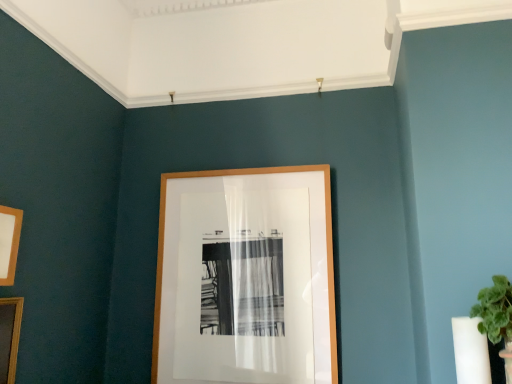
Question: From a real-world perspective, does wooden picture frame at lower left, which is counted as the 3th picture frame, starting from the back, sit lower than wooden picture frame at center, positioned as the third picture frame in left-to-right order?

Choices:
 (A) no
 (B) yes

Answer: (B)

Question: Is wooden picture frame at lower left, which appears as the 3th picture frame when viewed from the right, looking in the opposite direction of wooden picture frame at center, marked as the 3th picture frame in a front-to-back arrangement?

Choices:
 (A) yes
 (B) no

Answer: (B)

Question: Can you confirm if wooden picture frame at lower left, which appears as the 3th picture frame when viewed from the right, is thinner than wooden picture frame at center, marked as the 3th picture frame in a front-to-back arrangement?

Choices:
 (A) yes
 (B) no

Answer: (A)

Question: Is wooden picture frame at lower left, which appears as the 3th picture frame when viewed from the right, directly adjacent to wooden picture frame at center, positioned as the third picture frame in left-to-right order?

Choices:
 (A) no
 (B) yes

Answer: (A)

Question: From the image's perspective, does wooden picture frame at lower left, the first picture frame positioned from the left, appear lower than wooden picture frame at center, positioned as the third picture frame in left-to-right order?

Choices:
 (A) no
 (B) yes

Answer: (B)

Question: Visually, is wooden picture frame at center, the 1th picture frame viewed from the right, positioned to the left or to the right of wooden picture frame at left, which is the second picture frame in right-to-left order?

Choices:
 (A) left
 (B) right

Answer: (B)

Question: From the image's perspective, is wooden picture frame at center, the 1th picture frame viewed from the right, positioned above or below wooden picture frame at left, the 2th picture frame in the left-to-right sequence?

Choices:
 (A) above
 (B) below

Answer: (B)

Question: Is wooden picture frame at center, which ranks as the 1th picture frame in back-to-front order, inside or outside of wooden picture frame at left, which is the second picture frame in right-to-left order?

Choices:
 (A) inside
 (B) outside

Answer: (B)

Question: From a real-world perspective, is wooden picture frame at center, positioned as the third picture frame in left-to-right order, above or below wooden picture frame at left, acting as the second picture frame starting from the front?

Choices:
 (A) below
 (B) above

Answer: (A)

Question: Is wooden picture frame at center, marked as the 3th picture frame in a front-to-back arrangement, inside or outside of wooden picture frame at lower left, which appears as the 3th picture frame when viewed from the right?

Choices:
 (A) outside
 (B) inside

Answer: (A)

Question: From the image's perspective, relative to wooden picture frame at lower left, the first picture frame positioned from the left, is wooden picture frame at center, marked as the 3th picture frame in a front-to-back arrangement, above or below?

Choices:
 (A) below
 (B) above

Answer: (B)

Question: Is point (263, 372) closer or farther from the camera than point (7, 332)?

Choices:
 (A) farther
 (B) closer

Answer: (A)

Question: Based on their positions, is wooden picture frame at center, marked as the 3th picture frame in a front-to-back arrangement, located to the left or right of wooden picture frame at lower left, which is counted as the 3th picture frame, starting from the back?

Choices:
 (A) left
 (B) right

Answer: (B)

Question: From a real-world perspective, is wooden picture frame at left, the 2th picture frame in the left-to-right sequence, positioned above or below wooden picture frame at lower left, which is the first picture frame from front to back?

Choices:
 (A) below
 (B) above

Answer: (B)

Question: Visually, is wooden picture frame at left, which is the second picture frame in right-to-left order, positioned to the left or to the right of wooden picture frame at lower left, which is counted as the 3th picture frame, starting from the back?

Choices:
 (A) right
 (B) left

Answer: (A)